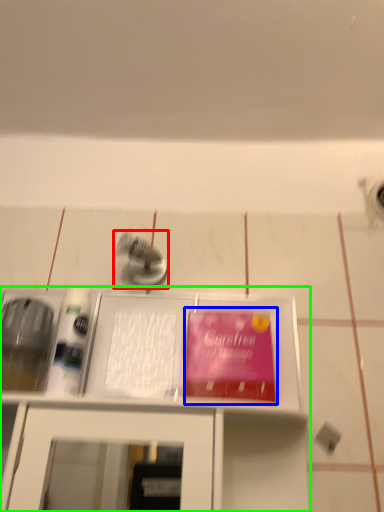
Question: Which object is positioned closest to tap (highlighted by a red box)? Select from paperback book (highlighted by a blue box) and furniture (highlighted by a green box).

Choices:
 (A) paperback book
 (B) furniture

Answer: (A)